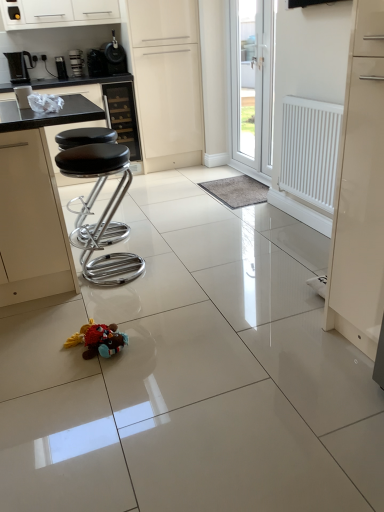
Question: Considering the positions of brushed metal coffee machine at upper left, the 4th appliance viewed from the front, and white matte door at center, acting as the second door starting from the right, in the image, is brushed metal coffee machine at upper left, the 4th appliance viewed from the front, bigger or smaller than white matte door at center, acting as the second door starting from the right,?

Choices:
 (A) small
 (B) big

Answer: (A)

Question: From the image's perspective, relative to white matte door at center, the first door viewed from the left, is brushed metal coffee machine at upper left, which is the third appliance from top to bottom, above or below?

Choices:
 (A) below
 (B) above

Answer: (B)

Question: Considering the real-world distances, which object is farthest from the black leather bar stools at left?

Choices:
 (A) white matte door at center, the first door viewed from the left
 (B) plush multicolored toy at center
 (C) black matte coffee maker at upper left, the 4th appliance from the bottom
 (D) white glossy cabinet at upper center, acting as the 2th cabinetry starting from the bottom
 (E) black plastic coffee machine at left, which ranks as the first coffee machine in left-to-right order

Answer: (E)

Question: Estimate the real-world distances between objects in this image. Which object is closer to the plush multicolored toy at center?

Choices:
 (A) black leather cabinet at upper center, which is the first cabinetry from bottom to top
 (B) black leather stool at left
 (C) white glossy cabinet at upper center, acting as the 2th cabinetry starting from the bottom
 (D) white matte door at center, the first door viewed from the left
 (E) black leather bar stools at left

Answer: (E)